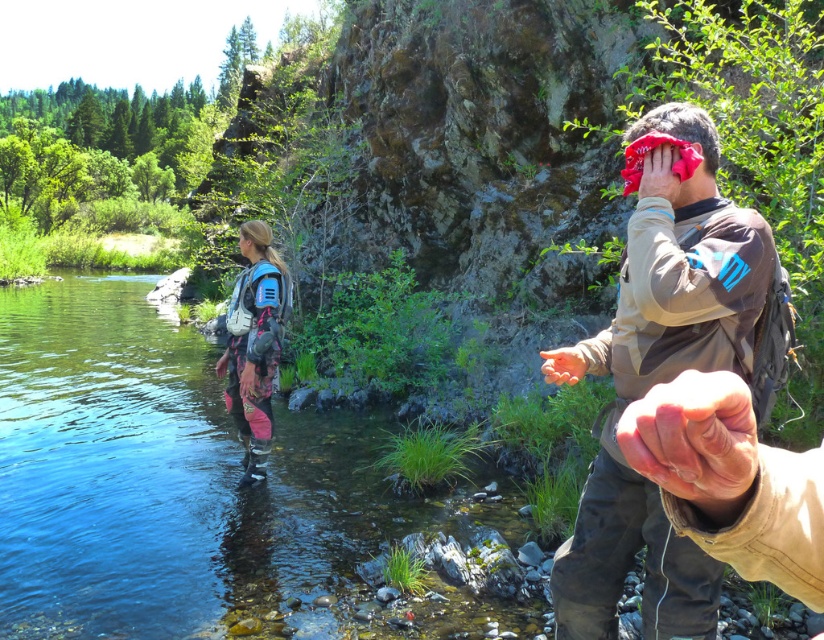
You are a photographer positioned at the riverbank. You want to capture a photo of the clear blue water at center without the matte brown hand at center obstructing it. Is the hand currently blocking the view of the water?

The matte brown hand at center is behind the clear blue water at center, so it is not obstructing the view. You can take the photo without any issue.

You are standing in the scene and want to reach both the point at coordinates point (x=97, y=406) and point (x=558, y=362). Which point should you reach first to minimize the distance traveled?

You should reach point (x=97, y=406) first because it is closer to you than point (x=558, y=362), which is further away.